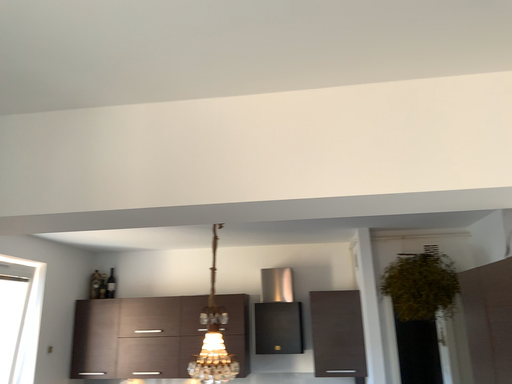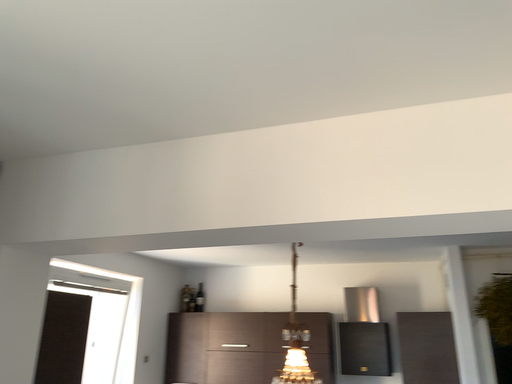
Question: How did the camera likely rotate when shooting the video?

Choices:
 (A) rotated left
 (B) rotated right

Answer: (A)